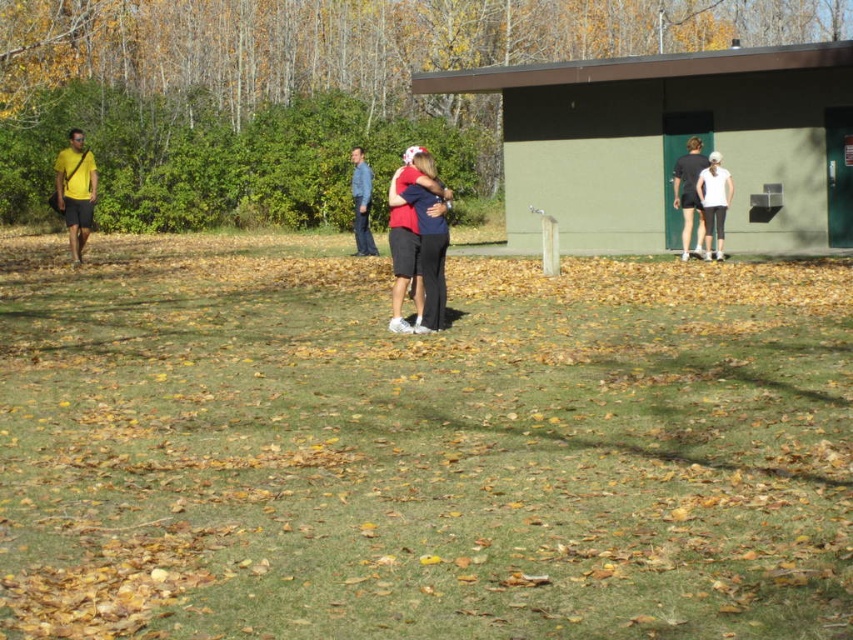
You are a photographer trying to capture the scene of two people embracing in the autumn park. You notice dark gray shorts at right and white matte leggings at right in the background. Which clothing item is covering the other?

The dark gray shorts at right is positioned over white matte leggings at right, so the dark gray shorts at right is covering the white matte leggings at right.

You are a photographer standing in the park and want to capture a photo of the yellow matte shirt at left and the white matte leggings at right. Which of the two should you focus on first if you want to ensure both are in sharp focus?

The yellow matte shirt at left is in front of the white matte leggings at right, so you should focus on the yellow matte shirt at left first to ensure both are in sharp focus.